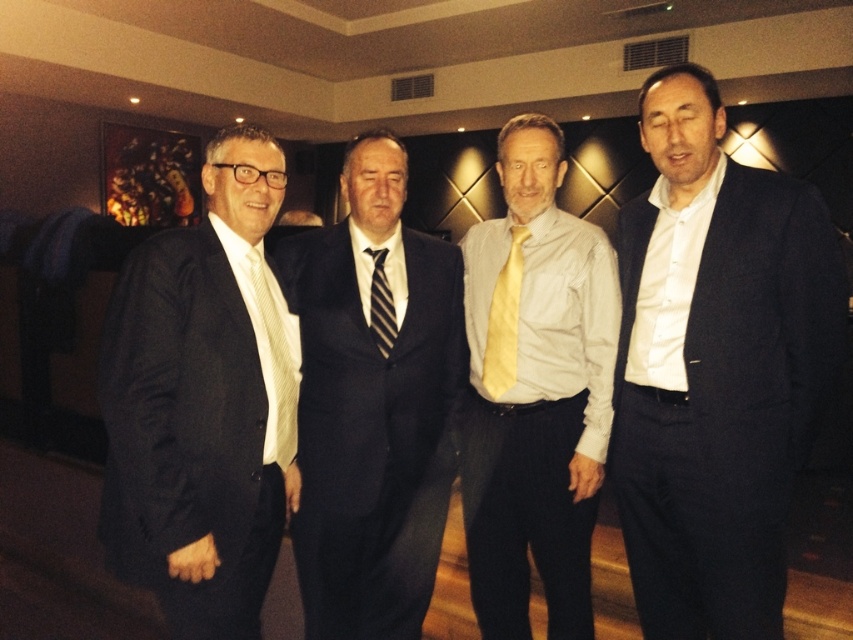
You are a photographer setting up for a group photo. You need to ensure that the matte black suit at left and the striped fabric tie at center are both visible in the frame. Given their height difference, which object will require you to adjust your camera angle upwards to capture properly?

The matte black suit at left has a greater height compared to the striped fabric tie at center, so you will need to adjust the camera angle upwards to capture the matte black suit at left properly.